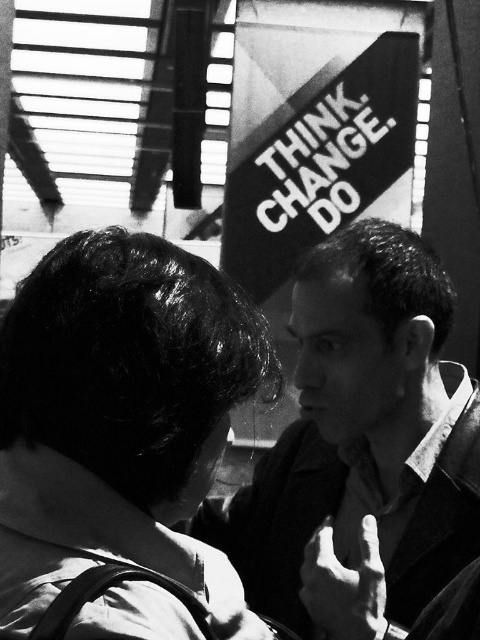
You are a photographer analyzing this image. You notice the smooth black shirt at center and the smooth skin hand at center. Which object is located to the right of the other?

The smooth black shirt at center is positioned on the right side of smooth skin hand at center.